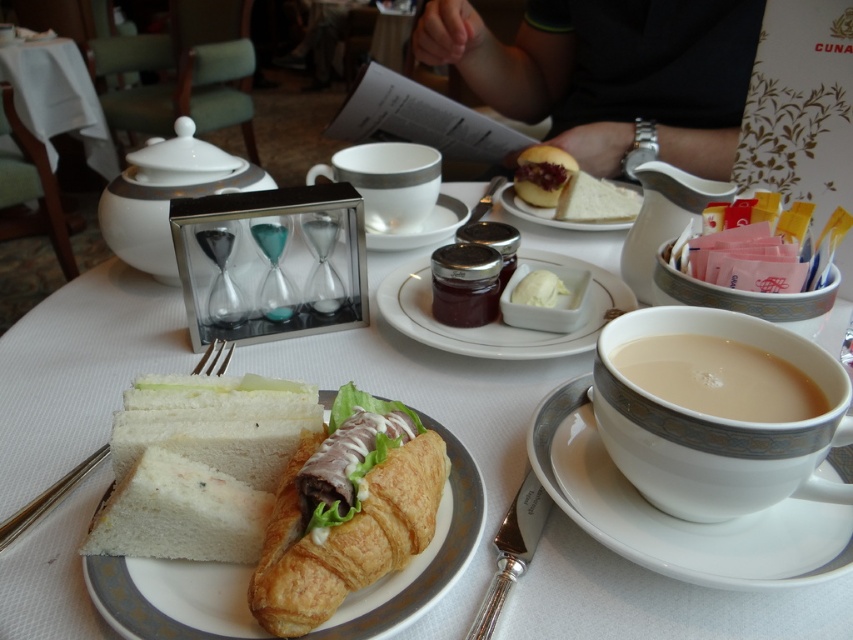
You are a GUI agent. You are given a task and a screenshot of the screen. Output one action in this format:
    pyautogui.click(x=<x>, y=<y>)
    Task: Click on the white porcelain cup at upper center
    Image resolution: width=853 pixels, height=640 pixels.
    Given the screenshot: What is the action you would take?
    pyautogui.click(x=79, y=371)

Identify the location of white porcelain cup at upper center. This screenshot has height=640, width=853. [x=79, y=371].

Can you confirm if white porcelain cup at upper center is thinner than silvermetallicfork at left?

Incorrect, white porcelain cup at upper center's width is not less than silvermetallicfork at left's.

Does point (33, 481) come in front of point (223, 372)?

Yes, it is in front of point (223, 372).

Find the location of a particular element. white porcelain cup at upper center is located at coordinates (79, 371).

Can you confirm if white ceramic sugar bowl at upper left is smaller than silvermetallicfork at left?

Actually, white ceramic sugar bowl at upper left might be larger than silvermetallicfork at left.

From the picture: Who is more distant from viewer, (160, 220) or (67, 476)?

Positioned behind is point (160, 220).

Where is `white ceramic sugar bowl at upper left`? This screenshot has height=640, width=853. white ceramic sugar bowl at upper left is located at coordinates (167, 195).